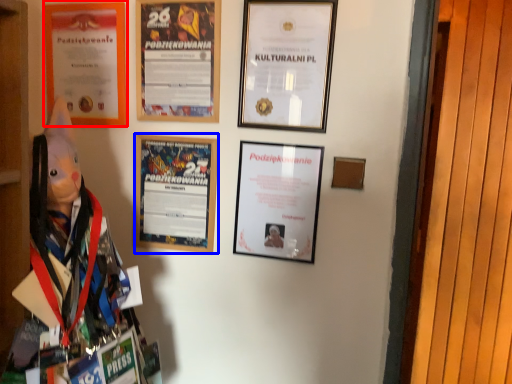
Question: Which object appears closest to the camera in this image, picture frame (highlighted by a red box) or picture frame (highlighted by a blue box)?

Choices:
 (A) picture frame
 (B) picture frame

Answer: (B)